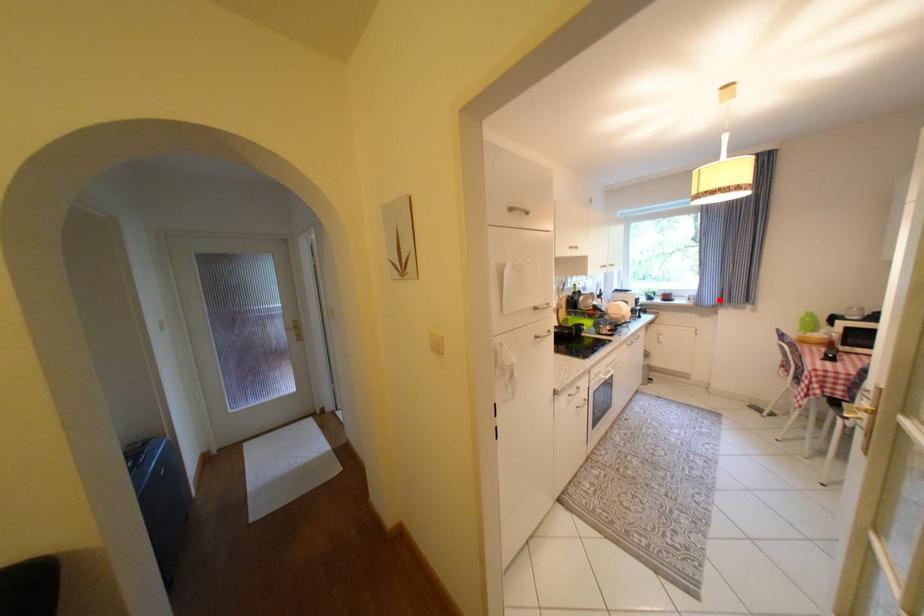
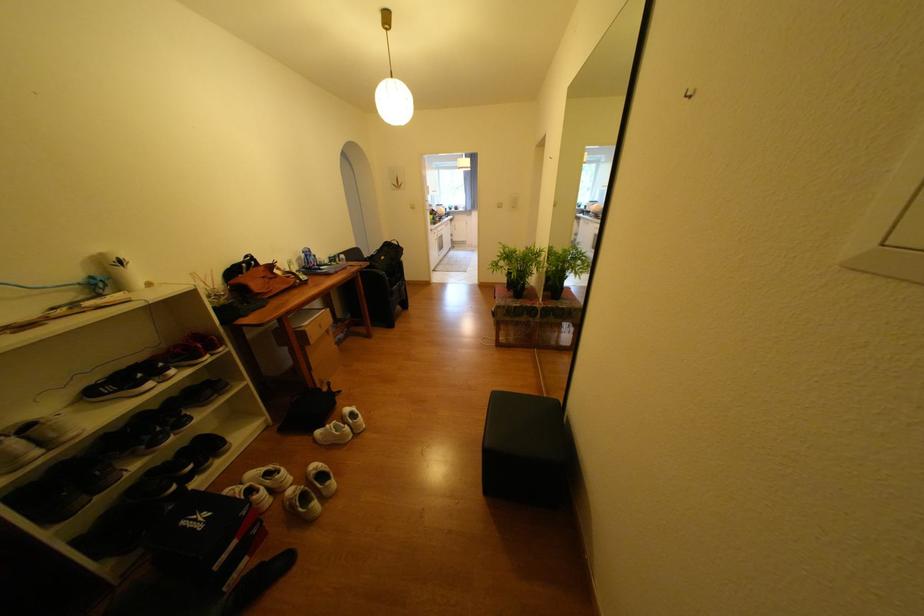
Question: I am providing you with two images of the same scene from different viewpoints. Image1 has a red point marked. In image2, the corresponding 3D location appears at what relative position? Reply with the corresponding letter.

Choices:
 (A) Closer
 (B) Farther

Answer: (A)